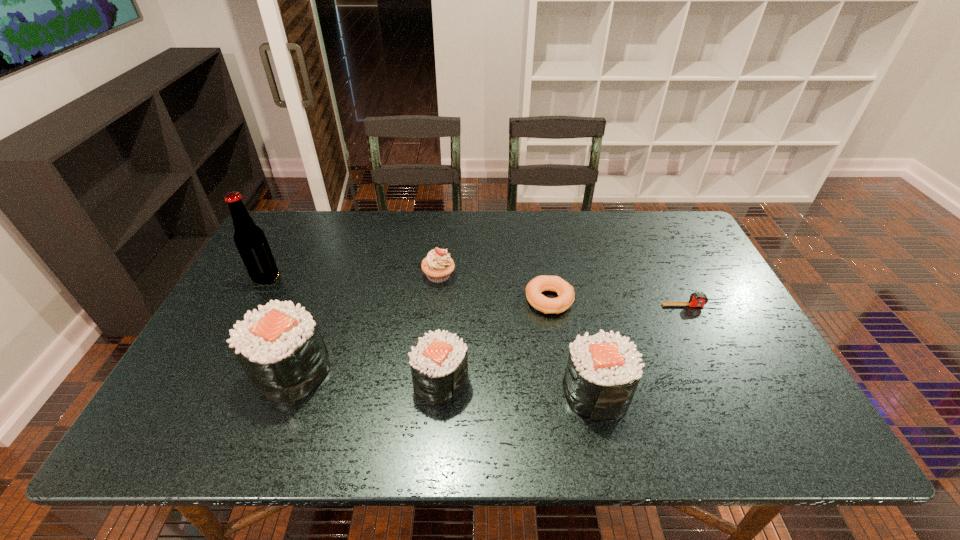
Where is `the leftmost sushi`? the leftmost sushi is located at coordinates (280, 348).

You are a GUI agent. You are given a task and a screenshot of the screen. Output one action in this format:
    pyautogui.click(x=<x>, y=<y>)
    Task: Click on the shortest sushi
    
    Given the screenshot: What is the action you would take?
    pyautogui.click(x=439, y=361)

Image resolution: width=960 pixels, height=540 pixels. What are the coordinates of `the second tallest sushi` in the screenshot? It's located at (603, 371).

Identify the location of the fifth shortest object. (603, 371).

I want to click on cupcake, so click(437, 266).

You are a GUI agent. You are given a task and a screenshot of the screen. Output one action in this format:
    pyautogui.click(x=<x>, y=<y>)
    Task: Click on the beer bottle
    Image resolution: width=960 pixels, height=540 pixels.
    Given the screenshot: What is the action you would take?
    pyautogui.click(x=250, y=240)

Locate an element on the screen. the leftmost object is located at coordinates (250, 240).

I want to click on tape measure, so click(x=697, y=299).

The width and height of the screenshot is (960, 540). I want to click on bagel, so click(565, 291).

Identify the location of free space located 0.390m on the right of the sixth object from right to left. (492, 371).